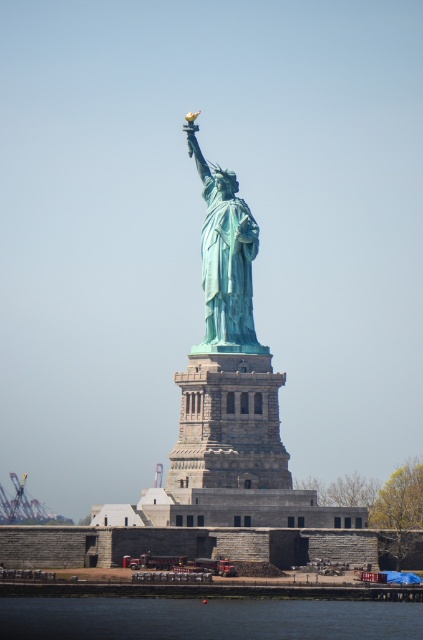
Does transparent water at lower center have a greater height compared to green patina statue at center?

No, transparent water at lower center is not taller than green patina statue at center.

Which of these two, transparent water at lower center or green patina statue at center, stands taller?

green patina statue at center

The image size is (423, 640). What do you see at coordinates (206, 618) in the screenshot? I see `transparent water at lower center` at bounding box center [206, 618].

Image resolution: width=423 pixels, height=640 pixels. In order to click on transparent water at lower center in this screenshot , I will do `click(206, 618)`.